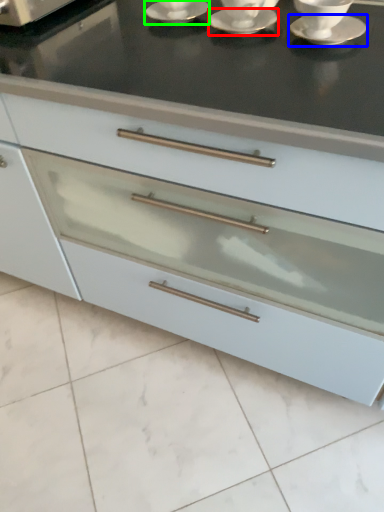
Question: Based on their relative distances, which object is farther from saucer (highlighted by a red box)? Choose from saucer (highlighted by a blue box) and saucer (highlighted by a green box).

Choices:
 (A) saucer
 (B) saucer

Answer: (A)